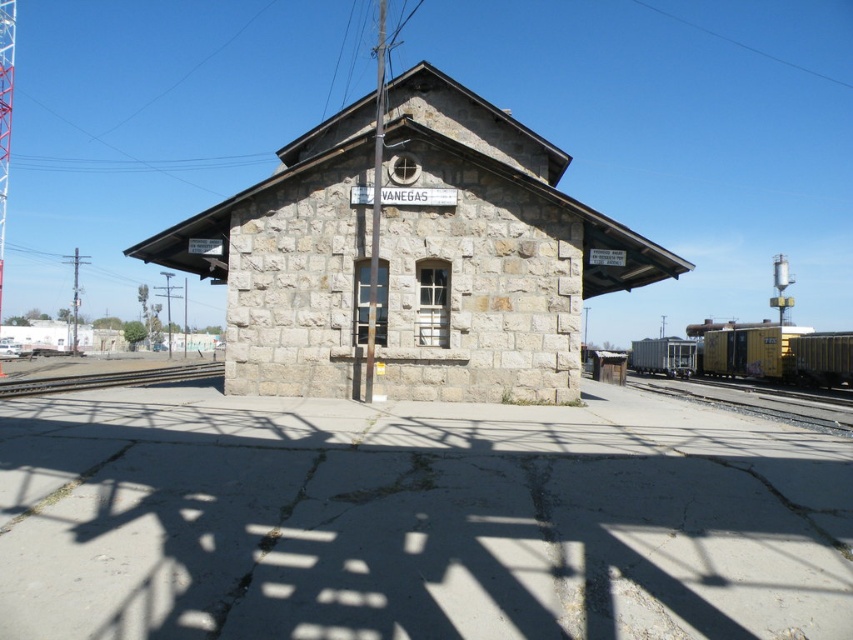
Question: Is yellow painted metal train car at right to the left of smooth yellow track at right from the viewer's perspective?

Choices:
 (A) no
 (B) yes

Answer: (A)

Question: Which of the following is the farthest from the observer?

Choices:
 (A) yellow painted metal train car at right
 (B) smooth yellow track at right
 (C) brown wooden train track at lower left
 (D) stone railway station at center

Answer: (A)

Question: Among these points, which one is farthest from the camera?

Choices:
 (A) (86, 378)
 (B) (718, 392)
 (C) (706, 372)
 (D) (310, 177)

Answer: (C)

Question: Which of these objects is positioned closest to the smooth yellow track at right?

Choices:
 (A) yellow painted metal train car at right
 (B) brown wooden train track at lower left

Answer: (A)

Question: From the image, what is the correct spatial relationship of smooth yellow track at right in relation to brown wooden train track at lower left?

Choices:
 (A) below
 (B) above

Answer: (A)

Question: Does stone railway station at center appear under brown wooden train track at lower left?

Choices:
 (A) yes
 (B) no

Answer: (B)